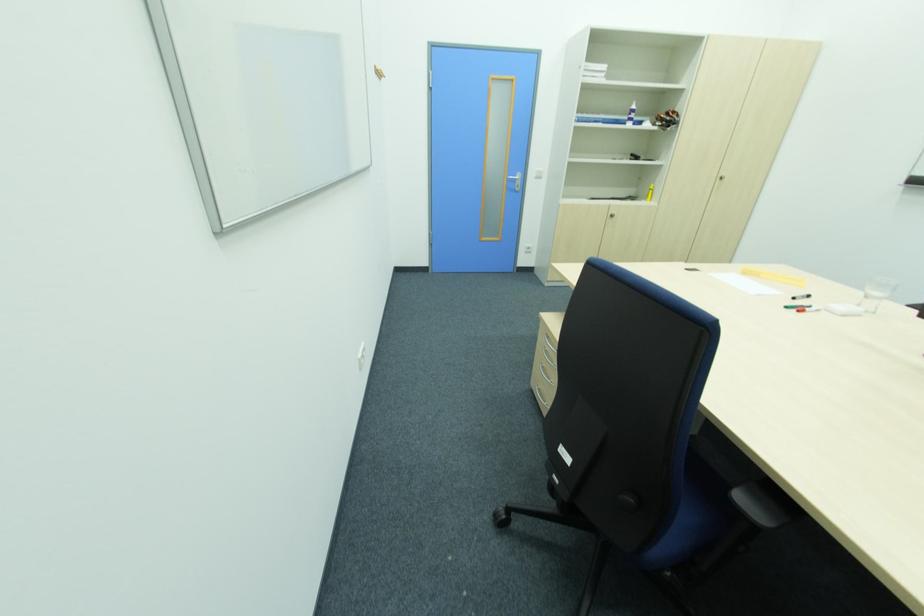
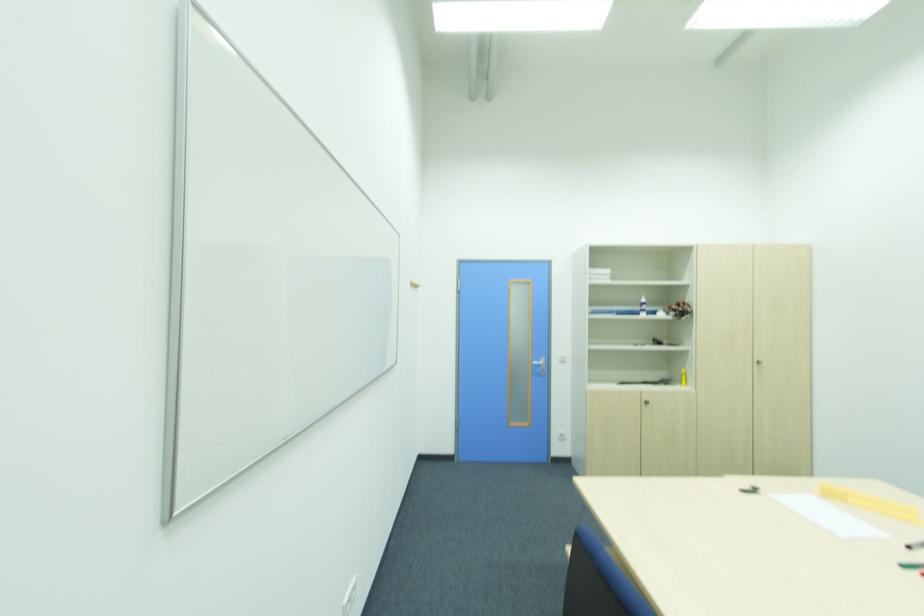
The point at (634, 107) is marked in the first image. Where is the corresponding point in the second image?

(643, 301)